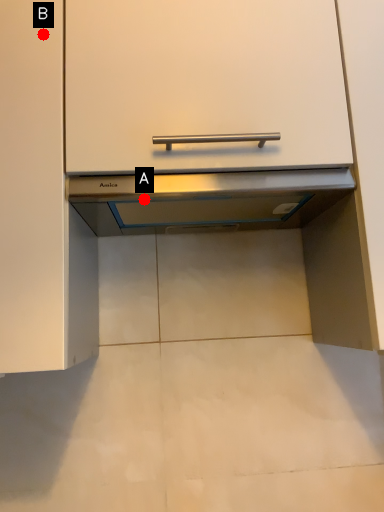
Question: Two points are circled on the image, labeled by A and B beside each circle. Which point appears farthest from the camera in this image?

Choices:
 (A) A is further
 (B) B is further

Answer: (A)